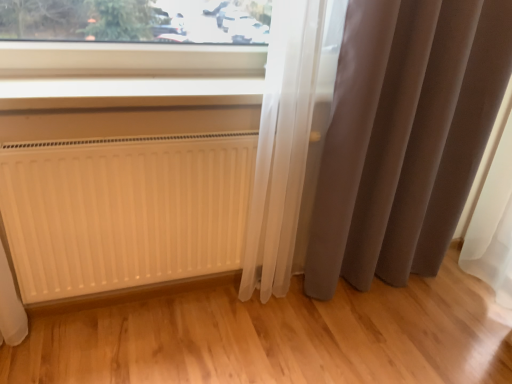
Question: From the image's perspective, is white matte radiator at lower left on matte gray curtain at right?

Choices:
 (A) yes
 (B) no

Answer: (B)

Question: Can you confirm if white matte radiator at lower left is wider than matte gray curtain at right?

Choices:
 (A) yes
 (B) no

Answer: (B)

Question: Is white matte radiator at lower left to the right of matte gray curtain at right from the viewer's perspective?

Choices:
 (A) yes
 (B) no

Answer: (B)

Question: Is white matte radiator at lower left located outside matte gray curtain at right?

Choices:
 (A) no
 (B) yes

Answer: (B)

Question: Does white matte radiator at lower left lie behind matte gray curtain at right?

Choices:
 (A) no
 (B) yes

Answer: (B)

Question: Considering the positions of point (87, 196) and point (158, 86), is point (87, 196) closer or farther from the camera than point (158, 86)?

Choices:
 (A) closer
 (B) farther

Answer: (A)

Question: Is white matte radiator at lower left wider or thinner than white plastic window sill at upper center?

Choices:
 (A) wide
 (B) thin

Answer: (B)

Question: Based on their positions, is white matte radiator at lower left located to the left or right of white plastic window sill at upper center?

Choices:
 (A) left
 (B) right

Answer: (A)

Question: Is white matte radiator at lower left bigger or smaller than white plastic window sill at upper center?

Choices:
 (A) big
 (B) small

Answer: (A)

Question: In terms of height, does white plastic window sill at upper center look taller or shorter compared to white matte radiator at lower left?

Choices:
 (A) short
 (B) tall

Answer: (A)

Question: Which is correct: white plastic window sill at upper center is inside white matte radiator at lower left, or outside of it?

Choices:
 (A) outside
 (B) inside

Answer: (A)

Question: Considering the positions of white plastic window sill at upper center and white matte radiator at lower left in the image, is white plastic window sill at upper center wider or thinner than white matte radiator at lower left?

Choices:
 (A) thin
 (B) wide

Answer: (B)

Question: From the image's perspective, is white plastic window sill at upper center positioned above or below white matte radiator at lower left?

Choices:
 (A) below
 (B) above

Answer: (B)

Question: Is matte gray curtain at right taller or shorter than white plastic window sill at upper center?

Choices:
 (A) tall
 (B) short

Answer: (A)

Question: From a real-world perspective, relative to white plastic window sill at upper center, is matte gray curtain at right vertically above or below?

Choices:
 (A) below
 (B) above

Answer: (A)